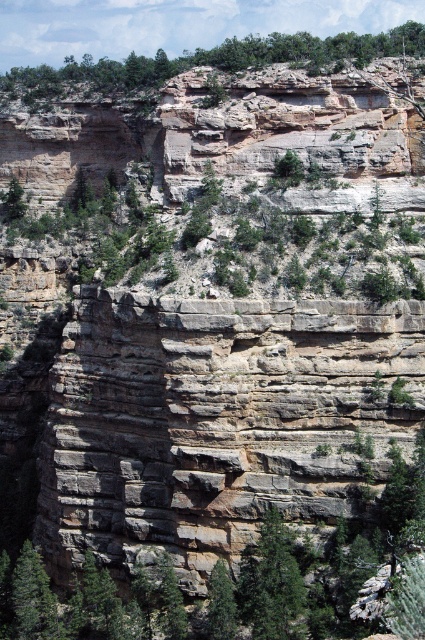
Who is more distant from viewer, [2,76] or [218,593]?

The point [2,76] is behind.

Does green leafy tree at upper center have a lesser width compared to green matte tree at lower center?

No.

Measure the distance between green leafy tree at upper center and camera.

green leafy tree at upper center is 79.05 meters away from camera.

Image resolution: width=425 pixels, height=640 pixels. In order to click on green leafy tree at upper center in this screenshot , I will do (206, 61).

Between green matte tree at center and green matte tree at lower left, which one appears on the right side from the viewer's perspective?

green matte tree at center is more to the right.

What do you see at coordinates (272, 582) in the screenshot?
I see `green matte tree at center` at bounding box center [272, 582].

Where is `green matte tree at center`? The width and height of the screenshot is (425, 640). green matte tree at center is located at coordinates (272, 582).

Who is positioned more to the right, green leafy tree at upper center or green matte tree at center?

Positioned to the right is green matte tree at center.

Which of these two, green leafy tree at upper center or green matte tree at center, stands shorter?

green matte tree at center

Find the location of a particular element. This screenshot has height=640, width=425. green leafy tree at upper center is located at coordinates (206, 61).